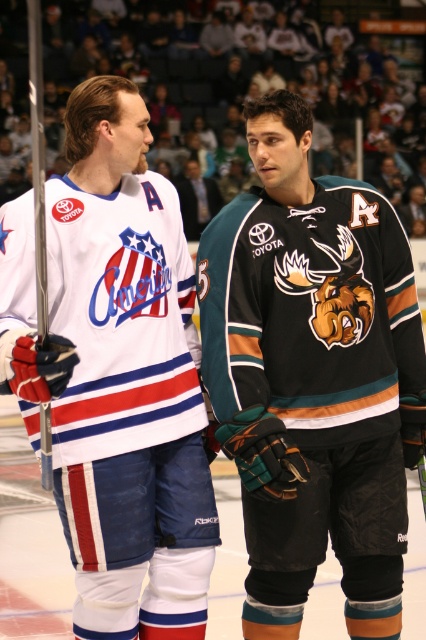
Question: Can you confirm if white matte hockey jersey at left is positioned to the right of dark blue jersey at center?

Choices:
 (A) yes
 (B) no

Answer: (A)

Question: Which object appears farthest from the camera in this image?

Choices:
 (A) teal jersey at center
 (B) white matte hockey jersey at left

Answer: (A)

Question: Estimate the real-world distances between objects in this image. Which object is closer to the dark blue jersey at center?

Choices:
 (A) teal jersey at center
 (B) white matte hockey jersey at left

Answer: (A)

Question: Among these objects, which one is farthest from the camera?

Choices:
 (A) white matte hockey jersey at left
 (B) teal jersey at center

Answer: (B)

Question: Is teal jersey at center wider than dark blue jersey at center?

Choices:
 (A) yes
 (B) no

Answer: (A)

Question: Is teal jersey at center closer to the viewer compared to white matte hockey jersey at left?

Choices:
 (A) no
 (B) yes

Answer: (A)